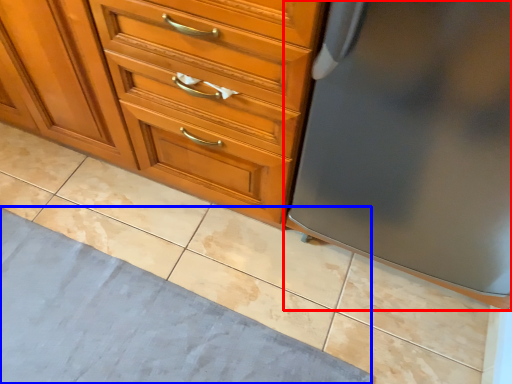
Question: Which object appears farthest to the camera in this image, refrigerator (highlighted by a red box) or bath mat (highlighted by a blue box)?

Choices:
 (A) refrigerator
 (B) bath mat

Answer: (B)